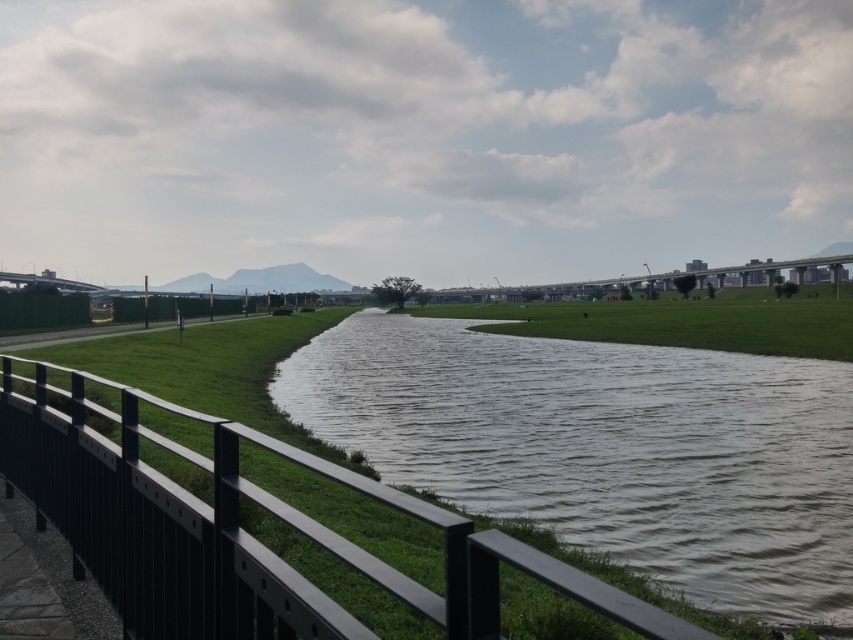
You are standing at the point labeled point (x=608, y=449) in the image. What surface are you currently standing on?

You are standing on the brown matte water at center.

Based on the photo, you are standing on the riverside walkway and want to take a photo of the brown matte water at center and the green grass at center. Which one should you focus on first to ensure both are in clear view?

You should focus on the brown matte water at center first because it is closer to you than the green grass at center, so adjusting the focus from near to far will help capture both in clear view.